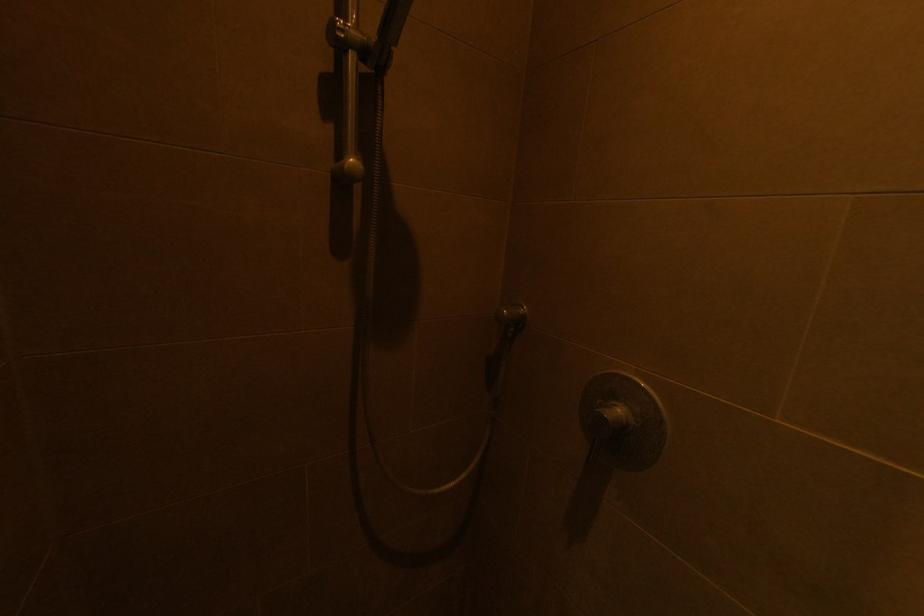
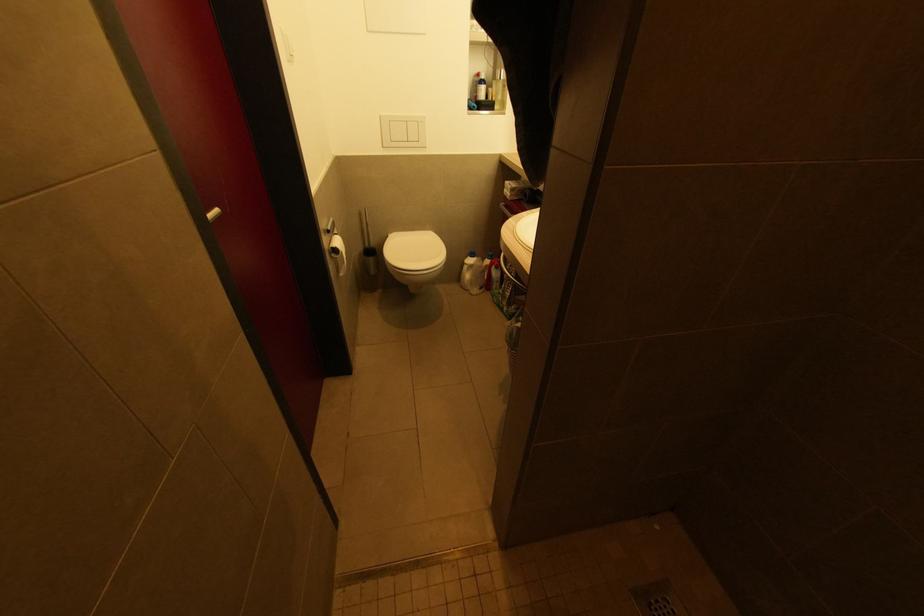
The first image is from the beginning of the video and the second image is from the end. How did the camera likely rotate when shooting the video?

The camera's rotation is toward left-down.